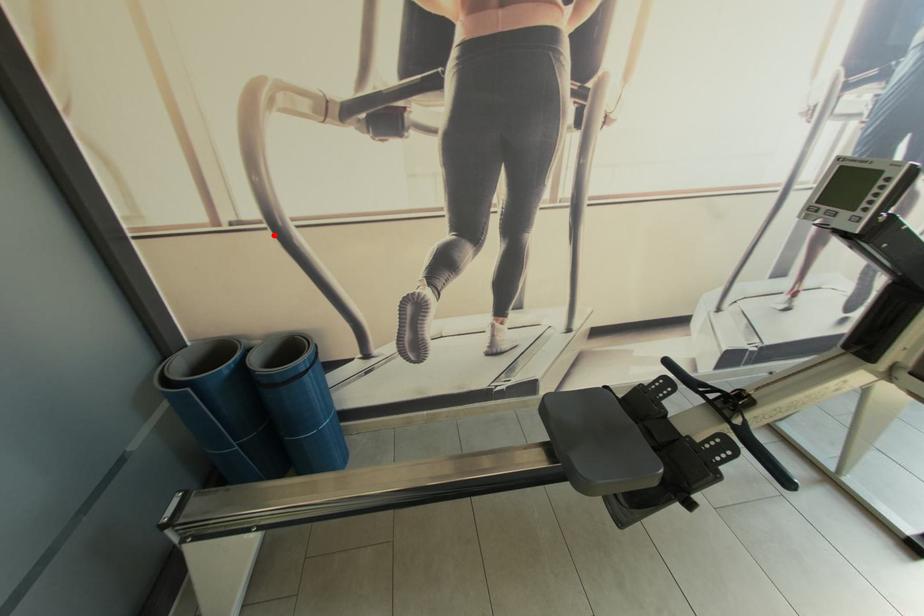
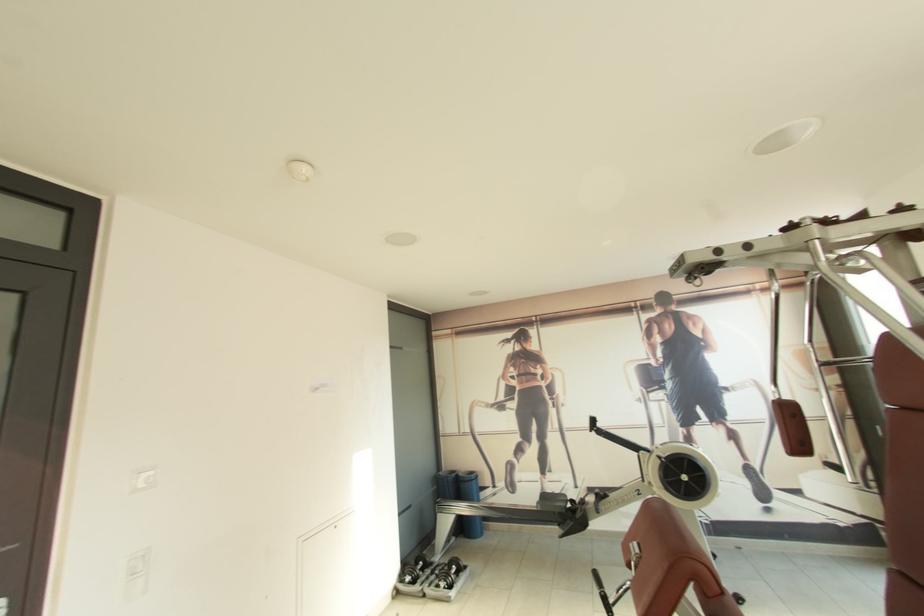
Question: I am providing you with two images of the same scene from different viewpoints. A red point is shown in image1. For the corresponding object point in image2, is it positioned nearer or farther from the camera?

Choices:
 (A) Nearer
 (B) Farther

Answer: (B)